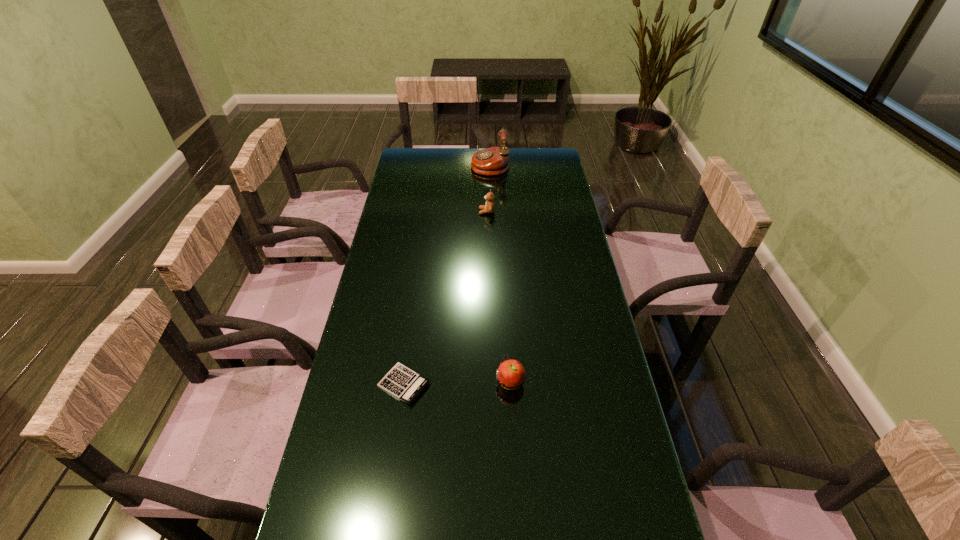
In the image, there is a desktop. Find the location of `vacant space at the far right corner`. vacant space at the far right corner is located at coordinates (557, 150).

Locate an element on the screen. free space between the calculator and the apple is located at coordinates (457, 383).

The image size is (960, 540). Identify the location of vacant point located between the calculator and the apple. (457, 383).

Identify the location of empty space that is in between the telephone and the teddy bear. (489, 188).

Find the location of a particular element. This screenshot has height=540, width=960. free space between the teddy bear and the shortest object is located at coordinates (445, 298).

Locate an element on the screen. The width and height of the screenshot is (960, 540). vacant region between the telephone and the apple is located at coordinates (500, 273).

At what (x,y) coordinates should I click in order to perform the action: click on empty space that is in between the tallest object and the apple. Please return your answer as a coordinate pair (x, y). The width and height of the screenshot is (960, 540). Looking at the image, I should click on (500, 273).

Identify the location of free point between the teddy bear and the shortest object. (x=445, y=298).

At what (x,y) coordinates should I click in order to perform the action: click on empty space between the tallest object and the shortest object. Please return your answer as a coordinate pair (x, y). The height and width of the screenshot is (540, 960). Looking at the image, I should click on (447, 274).

This screenshot has width=960, height=540. Find the location of `empty space that is in between the teddy bear and the apple`. empty space that is in between the teddy bear and the apple is located at coordinates (498, 296).